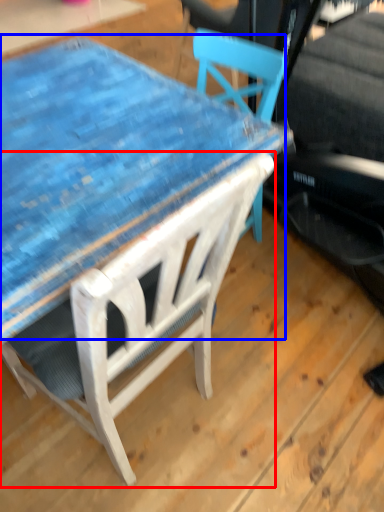
Question: Which of the following is the closest to the observer, chair (highlighted by a red box) or table (highlighted by a blue box)?

Choices:
 (A) chair
 (B) table

Answer: (A)